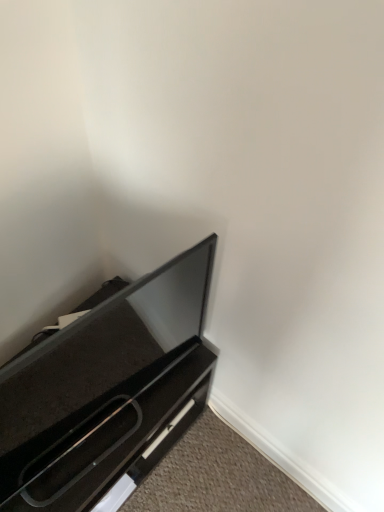
Where is `black glossy tv stand at lower left`? This screenshot has height=512, width=384. black glossy tv stand at lower left is located at coordinates (107, 393).

The height and width of the screenshot is (512, 384). Describe the element at coordinates (107, 393) in the screenshot. I see `black glossy tv stand at lower left` at that location.

This screenshot has width=384, height=512. Find the location of `black glossy tv stand at lower left`. black glossy tv stand at lower left is located at coordinates (107, 393).